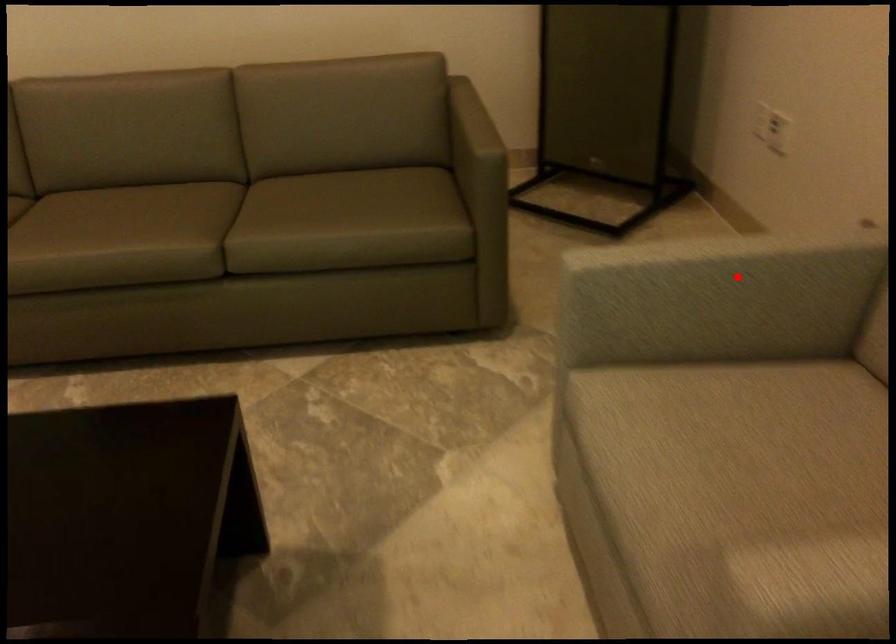
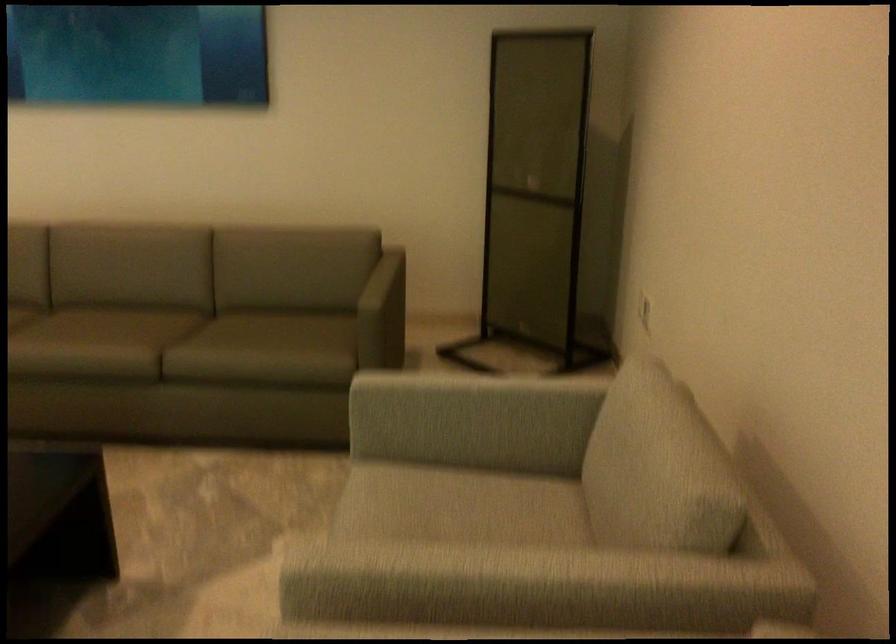
Question: I am providing you with two images of the same scene from different viewpoints. Image1 has a red point marked. In image2, the corresponding 3D location appears at what relative position? Reply with the corresponding letter.

Choices:
 (A) Closer
 (B) Farther

Answer: (B)